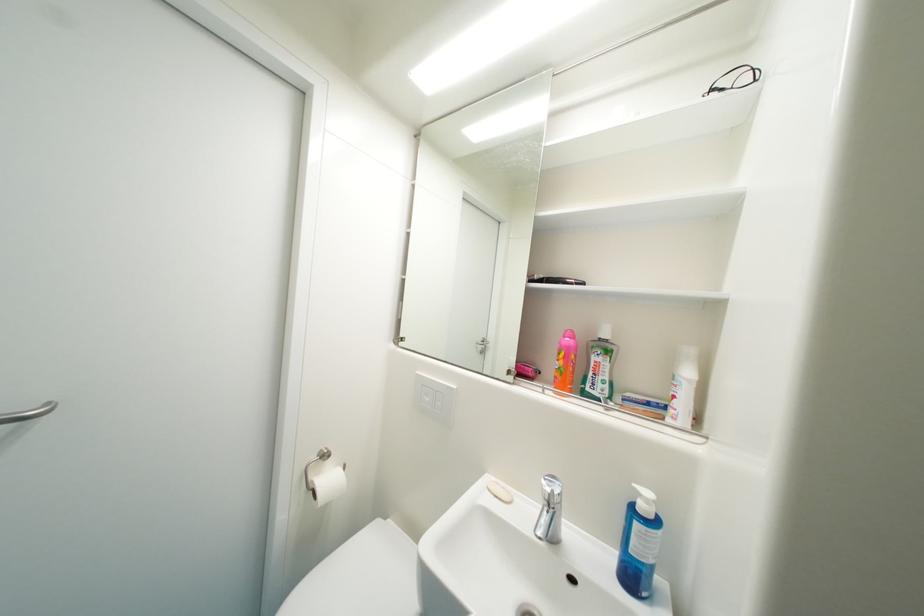
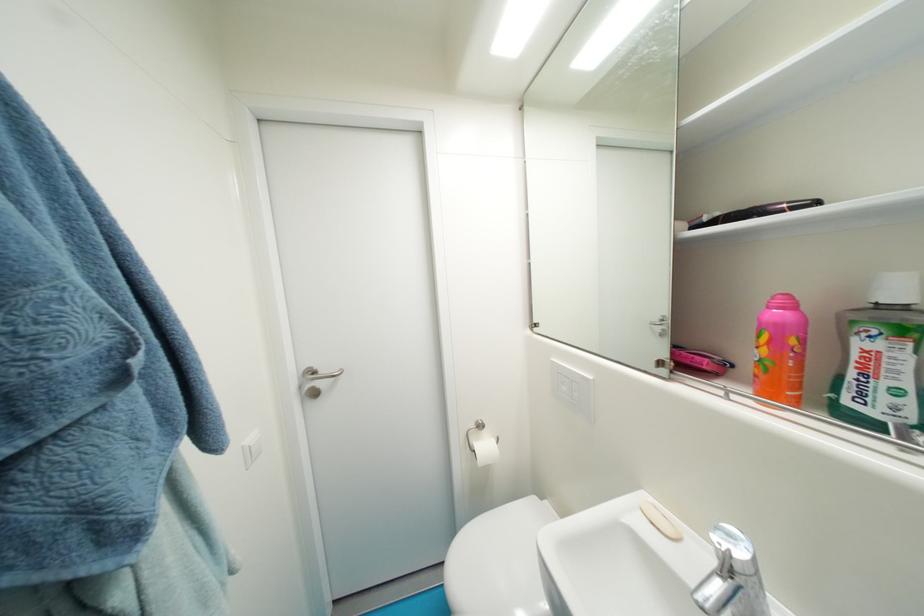
In the second image, find the point that corresponds to the point at 433,400 in the first image.

(570, 390)